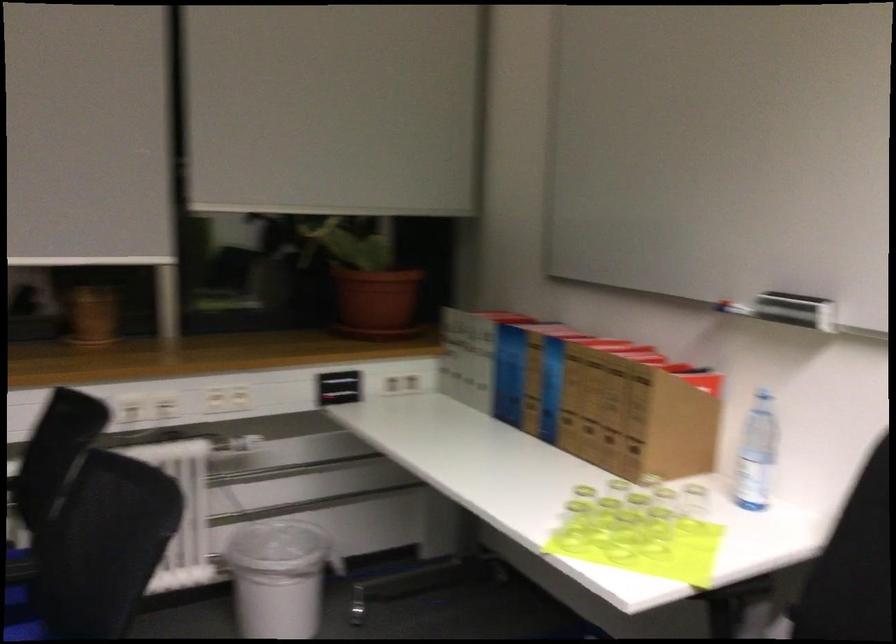
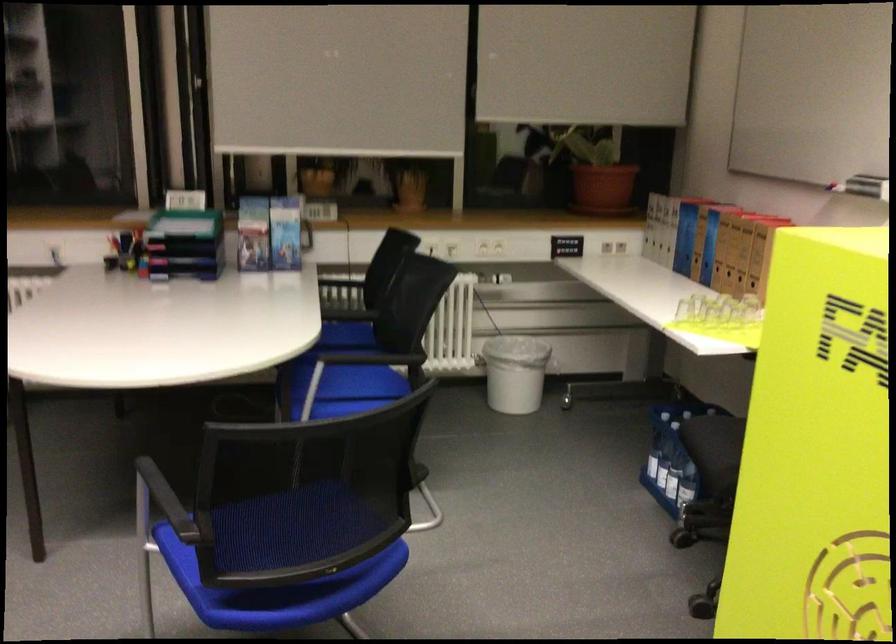
Question: I am providing you with two images of the same scene from different viewpoints. Which of the following objects are not visible in image2?

Choices:
 (A) clear water bottle
 (B) small glass cup
 (C) green organizer tray
 (D) vanity cabinet handle

Answer: (B)